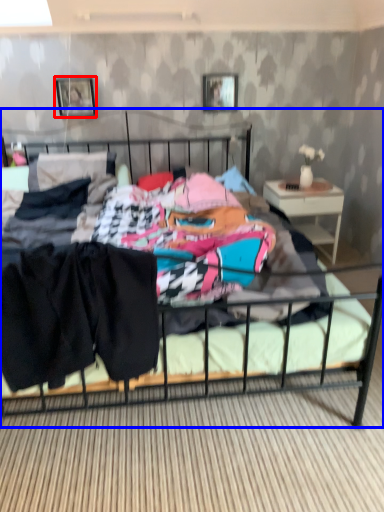
Question: Which of the following is the farthest to the observer, picture frame (highlighted by a red box) or bed (highlighted by a blue box)?

Choices:
 (A) picture frame
 (B) bed

Answer: (A)